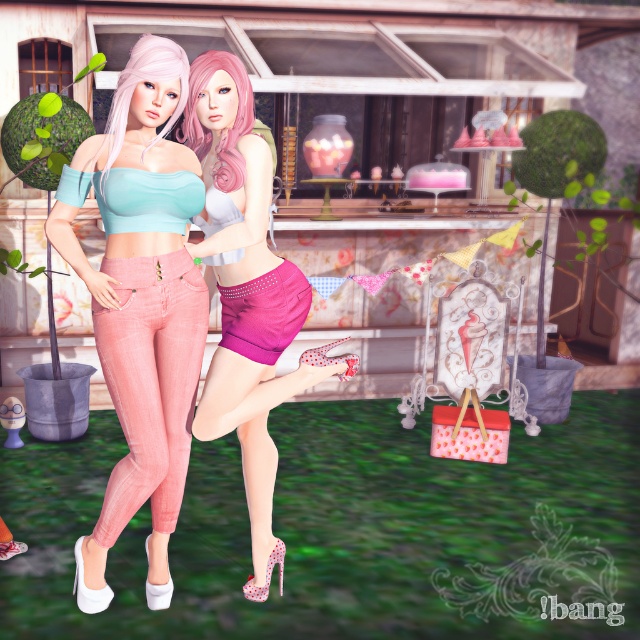
How much distance is there between matte pink shorts at center and matte pink jeans at lower left?

matte pink shorts at center is 12.84 inches from matte pink jeans at lower left.

Is matte pink shorts at center behind matte pink jeans at lower left?

Yes, matte pink shorts at center is further from the viewer.

Locate an element on the screen. matte pink shorts at center is located at coordinates (244, 291).

Does matte pink shorts at center appear over shiny magenta shorts at center?

No.

Does matte pink shorts at center have a greater height compared to shiny magenta shorts at center?

Indeed, matte pink shorts at center has a greater height compared to shiny magenta shorts at center.

Locate an element on the screen. This screenshot has width=640, height=640. matte pink shorts at center is located at coordinates (244, 291).

Does matte pink jeans at center have a greater height compared to shiny magenta shorts at center?

Yes.

This screenshot has width=640, height=640. I want to click on matte pink jeans at center, so click(140, 304).

Where is `matte pink jeans at center`? The image size is (640, 640). matte pink jeans at center is located at coordinates (140, 304).